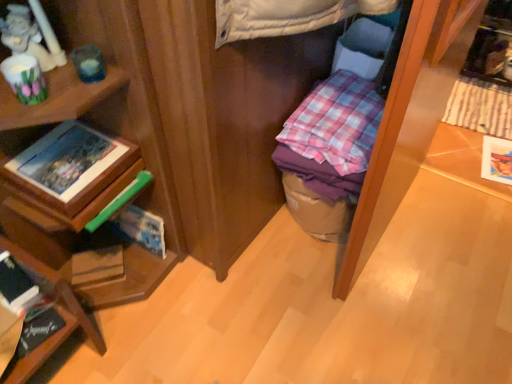
The image size is (512, 384). What do you see at coordinates (71, 165) in the screenshot?
I see `wooden photo frame at left, arranged as the 1th book when viewed from the top` at bounding box center [71, 165].

The image size is (512, 384). I want to click on pink checkered fabric at center, so click(336, 123).

Where is `hardcover book at lower left, the 2th book in the bottom-to-top sequence`? The image size is (512, 384). hardcover book at lower left, the 2th book in the bottom-to-top sequence is located at coordinates (17, 285).

Measure the distance between wooden bookshelf at lower left and camera.

The depth of wooden bookshelf at lower left is 38.23 inches.

In order to click on wooden bookshelf at lower left in this screenshot , I will do `click(59, 314)`.

Locate an element on the screen. The height and width of the screenshot is (384, 512). matte brown book at lower left, which is the 3th paperback book in right-to-left order is located at coordinates (97, 266).

Find the location of a particular element. The image size is (512, 384). hardcover book at lower left, the third book when ordered from top to bottom is located at coordinates click(38, 331).

Between wooden photo frame at left, acting as the third book starting from the bottom, and hardcover book at left, the second paperback book positioned from the bottom, which one has larger width?

With larger width is wooden photo frame at left, acting as the third book starting from the bottom.

Does wooden photo frame at left, acting as the third book starting from the bottom, have a smaller size compared to hardcover book at left, which is counted as the 2th paperback book, starting from the left?

Incorrect, wooden photo frame at left, acting as the third book starting from the bottom, is not smaller in size than hardcover book at left, which is counted as the 2th paperback book, starting from the left.

This screenshot has width=512, height=384. Identify the location of the 1st paperback book positioned below the wooden photo frame at left, acting as the third book starting from the bottom (from the image's perspective). (141, 229).

Is hardcover book at lower left, the 2th book in the bottom-to-top sequence, in front of or behind hardcover book at lower left, which is the first book from bottom to top, in the image?

hardcover book at lower left, the 2th book in the bottom-to-top sequence, is in front of hardcover book at lower left, which is the first book from bottom to top.

From a real-world perspective, relative to hardcover book at lower left, the third book when ordered from top to bottom, is hardcover book at lower left, the 2th book in the top-to-bottom sequence, vertically above or below?

hardcover book at lower left, the 2th book in the top-to-bottom sequence, is situated higher than hardcover book at lower left, the third book when ordered from top to bottom, in the real world.

Can you confirm if hardcover book at lower left, the 2th book in the top-to-bottom sequence, is taller than hardcover book at lower left, the third book when ordered from top to bottom?

Yes, hardcover book at lower left, the 2th book in the top-to-bottom sequence, is taller than hardcover book at lower left, the third book when ordered from top to bottom.

Considering the relative positions of hardcover book at lower left, the 2th book in the bottom-to-top sequence, and hardcover book at lower left, which is the first book from bottom to top, in the image provided, is hardcover book at lower left, the 2th book in the bottom-to-top sequence, to the left of hardcover book at lower left, which is the first book from bottom to top, from the viewer's perspective?

No, hardcover book at lower left, the 2th book in the bottom-to-top sequence, is not to the left of hardcover book at lower left, which is the first book from bottom to top.

Could wooden photo frame at left, acting as the third book starting from the bottom, be considered to be inside matte paper paperback book at right, the third paperback book positioned from the left?

No, matte paper paperback book at right, the third paperback book positioned from the left, does not contain wooden photo frame at left, acting as the third book starting from the bottom.

From the image's perspective, is matte paper paperback book at right, which is the 1th paperback book in back-to-front order, above wooden photo frame at left, acting as the third book starting from the bottom?

Yes.

Identify the location of paperback book that is the 3rd one when counting backward from the wooden photo frame at left, arranged as the 1th book when viewed from the top. (497, 160).

Considering the relative sizes of pink checkered fabric at center and matte paper paperback book at right, acting as the 3th paperback book starting from the front, in the image provided, is pink checkered fabric at center smaller than matte paper paperback book at right, acting as the 3th paperback book starting from the front,?

Actually, pink checkered fabric at center might be larger than matte paper paperback book at right, acting as the 3th paperback book starting from the front.

Based on the photo, can you confirm if pink checkered fabric at center is positioned to the right of matte paper paperback book at right, the third paperback book positioned from the left?

No, pink checkered fabric at center is not to the right of matte paper paperback book at right, the third paperback book positioned from the left.

Between pink checkered fabric at center and matte paper paperback book at right, placed as the 1th paperback book when sorted from top to bottom, which one has smaller width?

matte paper paperback book at right, placed as the 1th paperback book when sorted from top to bottom, is thinner.

Is pink checkered fabric at center surrounding matte paper paperback book at right, the third paperback book positioned from the left?

No.

Which is farther from the camera, (15, 265) or (96, 342)?

Positioned behind is point (96, 342).

From a real-world perspective, is hardcover book at lower left, the 2th book in the bottom-to-top sequence, located beneath wooden bookshelf at lower left?

No, from a real-world perspective, hardcover book at lower left, the 2th book in the bottom-to-top sequence, is not under wooden bookshelf at lower left.

Consider the image. Would you say hardcover book at lower left, the 2th book in the bottom-to-top sequence, is inside or outside wooden bookshelf at lower left?

hardcover book at lower left, the 2th book in the bottom-to-top sequence, is located inside wooden bookshelf at lower left.

Could you measure the distance between hardcover book at left, which is the third paperback book from back to front, and matte paper paperback book at right, the third paperback book positioned from the left?

They are 4.64 feet apart.

Based on the photo, does hardcover book at left, placed as the 2th paperback book when sorted from right to left, have a lesser height compared to matte paper paperback book at right, acting as the 3th paperback book starting from the front?

In fact, hardcover book at left, placed as the 2th paperback book when sorted from right to left, may be taller than matte paper paperback book at right, acting as the 3th paperback book starting from the front.

Is hardcover book at left, the second paperback book positioned from the bottom, behind matte paper paperback book at right, which appears as the first paperback book when viewed from the right?

No, it is in front of matte paper paperback book at right, which appears as the first paperback book when viewed from the right.

Consider the image. Which of these two, hardcover book at left, the second paperback book positioned from the bottom, or matte paper paperback book at right, the third paperback book positioned from the left, is smaller?

matte paper paperback book at right, the third paperback book positioned from the left, is smaller.

Based on their positions, is pink checkered fabric at center located to the left or right of hardcover book at left, placed as the 2th paperback book when sorted from right to left?

In the image, pink checkered fabric at center appears on the right side of hardcover book at left, placed as the 2th paperback book when sorted from right to left.

How different are the orientations of pink checkered fabric at center and hardcover book at left, which is counted as the 2th paperback book, starting from the left, in degrees?

0.252 degrees.

Which object is wider, pink checkered fabric at center or hardcover book at left, which is counted as the 2th paperback book, starting from the left?

Wider between the two is pink checkered fabric at center.

Which point is more distant from viewer, (348, 146) or (150, 241)?

The point (150, 241) is behind.

This screenshot has width=512, height=384. In order to click on book that is the 3rd one above the hardcover book at left, which is the third paperback book from back to front (from a real-world perspective) in this screenshot , I will do `click(71, 165)`.

What are the coordinates of `book that appears below the hardcover book at lower left, the 2th book in the bottom-to-top sequence (from a real-world perspective)` in the screenshot? It's located at (38, 331).

Looking at the image, which one is located closer to hardcover book at left, positioned as the 2th paperback book in top-to-bottom order, matte paper paperback book at right, which ranks as the 3th paperback book in bottom-to-top order, or wooden photo frame at left, arranged as the 1th book when viewed from the top?

Among the two, wooden photo frame at left, arranged as the 1th book when viewed from the top, is located nearer to hardcover book at left, positioned as the 2th paperback book in top-to-bottom order.

From the image, which object appears to be nearer to matte brown book at lower left, which appears as the second paperback book when viewed from the back, wooden photo frame at left, acting as the third book starting from the bottom, or hardcover book at lower left, the 2th book in the top-to-bottom sequence?

Among the two, hardcover book at lower left, the 2th book in the top-to-bottom sequence, is located nearer to matte brown book at lower left, which appears as the second paperback book when viewed from the back.

Looking at the image, which one is located closer to hardcover book at lower left, the 2th book in the bottom-to-top sequence, matte brown book at lower left, which appears as the second paperback book when viewed from the back, or hardcover book at left, which is the third paperback book from back to front?

Among the two, matte brown book at lower left, which appears as the second paperback book when viewed from the back, is located nearer to hardcover book at lower left, the 2th book in the bottom-to-top sequence.

When comparing their distances from matte paper paperback book at right, which is the 1th paperback book in back-to-front order, does matte brown book at lower left, which is the first paperback book from left to right, or hardcover book at left, which is counted as the 2th paperback book, starting from the left, seem closer?

hardcover book at left, which is counted as the 2th paperback book, starting from the left, is closer to matte paper paperback book at right, which is the 1th paperback book in back-to-front order.

Looking at the image, which one is located closer to matte paper paperback book at right, which appears as the first paperback book when viewed from the right, hardcover book at left, the second paperback book positioned from the bottom, or wooden photo frame at left, acting as the third book starting from the bottom?

hardcover book at left, the second paperback book positioned from the bottom.

Looking at the image, which one is located closer to pink checkered fabric at center, hardcover book at lower left, which is the first book from bottom to top, or wooden photo frame at left, acting as the third book starting from the bottom?

wooden photo frame at left, acting as the third book starting from the bottom, lies closer to pink checkered fabric at center than the other object.

Looking at the image, which one is located further to hardcover book at lower left, the third book when ordered from top to bottom, hardcover book at left, the second paperback book positioned from the bottom, or pink checkered fabric at center?

Among the two, pink checkered fabric at center is located further to hardcover book at lower left, the third book when ordered from top to bottom.

Considering their positions, is matte brown book at lower left, which is the first paperback book from left to right, positioned closer to wooden photo frame at left, arranged as the 1th book when viewed from the top, than hardcover book at lower left, the 2th book in the bottom-to-top sequence?

hardcover book at lower left, the 2th book in the bottom-to-top sequence, is positioned closer to the anchor wooden photo frame at left, arranged as the 1th book when viewed from the top.

Where is `book between hardcover book at lower left, the 2th book in the top-to-bottom sequence, and matte paper paperback book at right, which ranks as the 3th paperback book in bottom-to-top order, from left to right`? This screenshot has height=384, width=512. book between hardcover book at lower left, the 2th book in the top-to-bottom sequence, and matte paper paperback book at right, which ranks as the 3th paperback book in bottom-to-top order, from left to right is located at coordinates (71, 165).

This screenshot has height=384, width=512. I want to click on book between wooden photo frame at left, acting as the third book starting from the bottom, and matte brown book at lower left, which ranks as the first paperback book in bottom-to-top order, from front to back, so click(x=38, y=331).

This screenshot has width=512, height=384. Identify the location of paperback book between wooden bookshelf at lower left and matte brown book at lower left, which is the 3th paperback book in right-to-left order, from front to back. (141, 229).

In order to click on book located between matte brown book at lower left, which is the second paperback book in front-to-back order, and matte paper paperback book at right, placed as the 1th paperback book when sorted from top to bottom, in the left-right direction in this screenshot , I will do `click(71, 165)`.